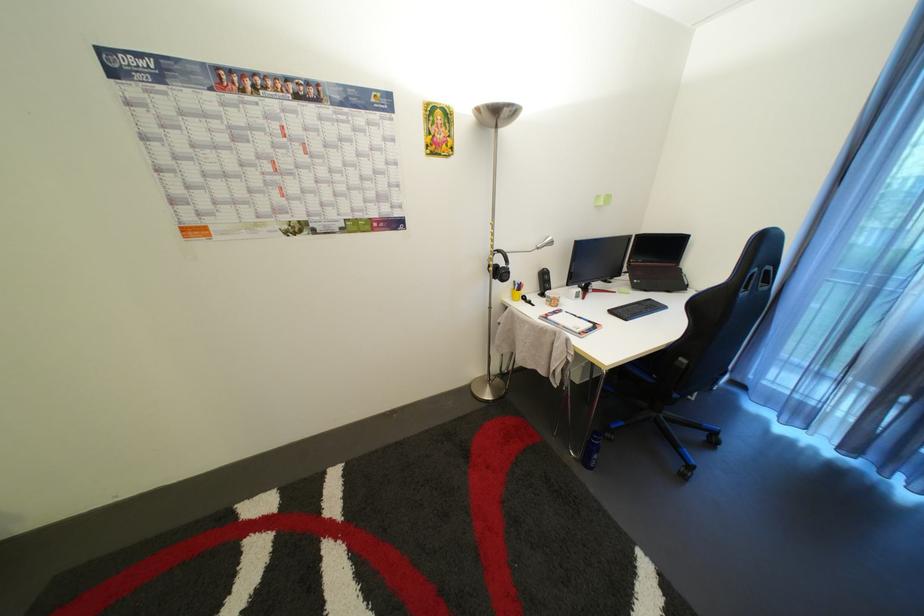
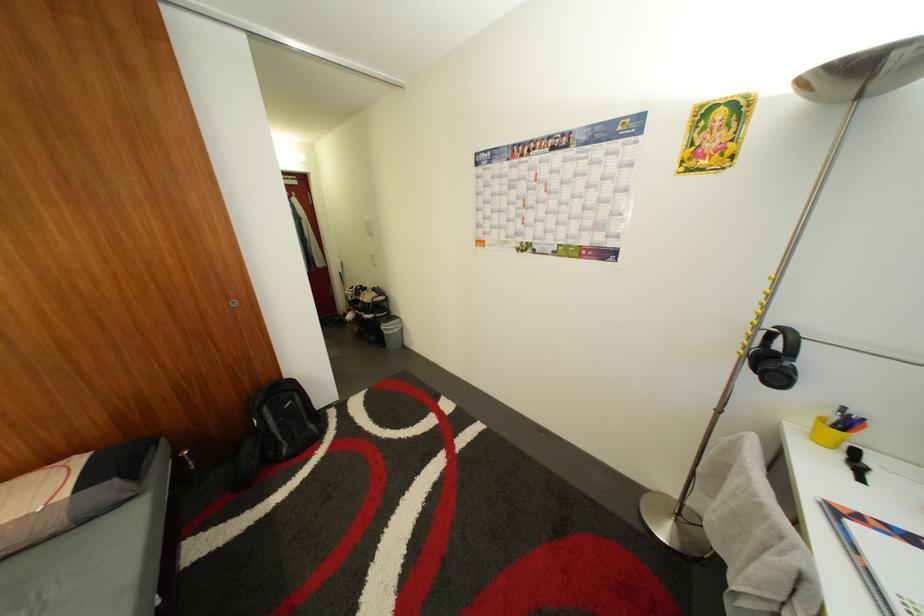
Question: The camera is either moving clockwise (left) or counter-clockwise (right) around the object. The first image is from the beginning of the video and the second image is from the end. Is the camera moving left or right when shooting the video?

Choices:
 (A) Left
 (B) Right

Answer: (B)